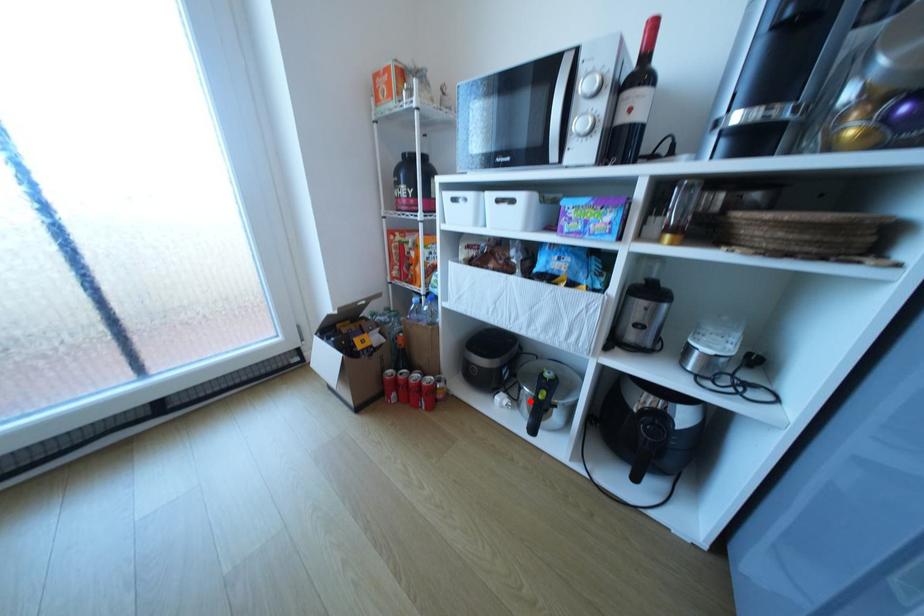
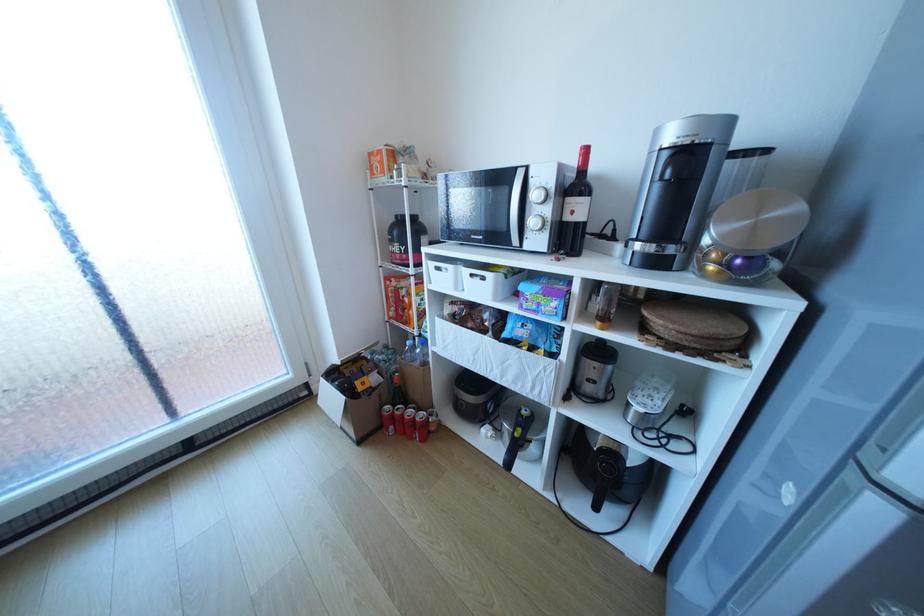
The point at the highlighted location is marked in the first image. Where is the corresponding point in the second image?

(513, 434)